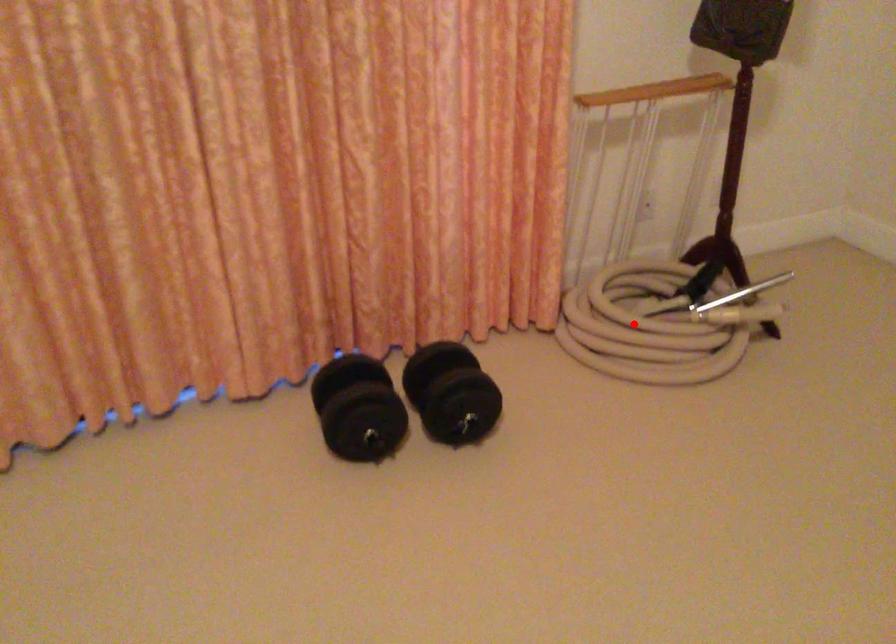
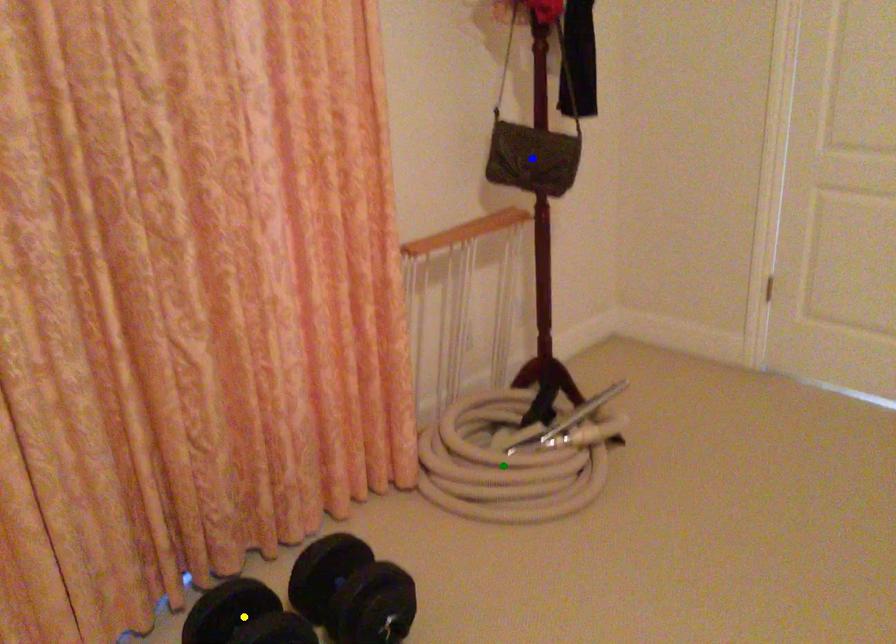
Question: I am providing you with two images of the same scene from different viewpoints. A red point is marked on the first image. You are given multiple points on the second image. Which mark in image 2 goes with the point in image 1?

Choices:
 (A) yellow point
 (B) blue point
 (C) green point

Answer: (C)